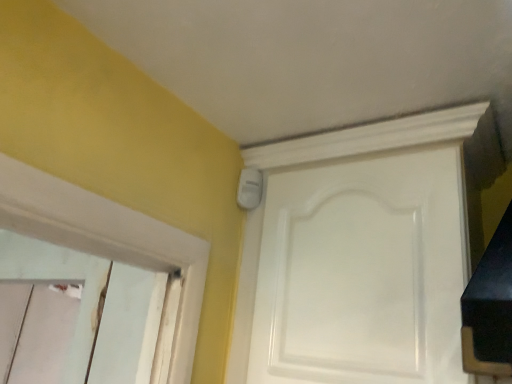
What do you see at coordinates (362, 271) in the screenshot? This screenshot has height=384, width=512. I see `white glossy door at upper center` at bounding box center [362, 271].

At what (x,y) coordinates should I click in order to perform the action: click on white glossy door at upper center. Please return your answer as a coordinate pair (x, y). Image resolution: width=512 pixels, height=384 pixels. Looking at the image, I should click on (362, 271).

At what (x,y) coordinates should I click in order to perform the action: click on white glossy door at upper center. Please return your answer as a coordinate pair (x, y). Looking at the image, I should click on (362, 271).